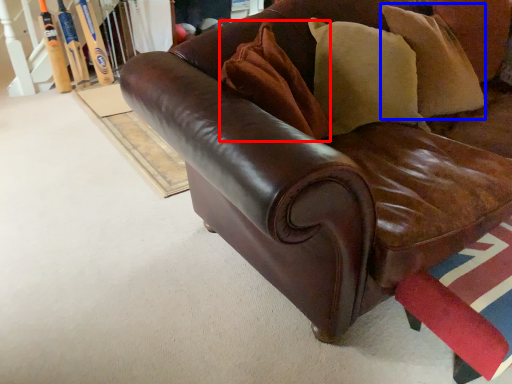
Question: Which of the following is the farthest to the observer, pillow (highlighted by a red box) or pillow (highlighted by a blue box)?

Choices:
 (A) pillow
 (B) pillow

Answer: (B)